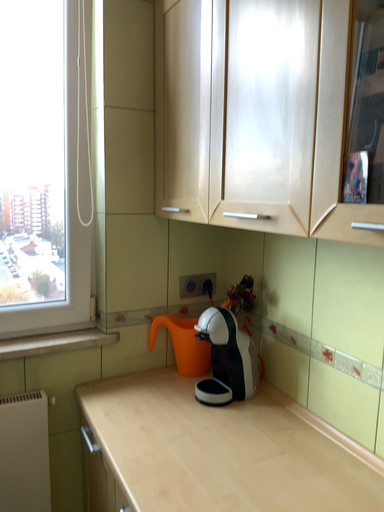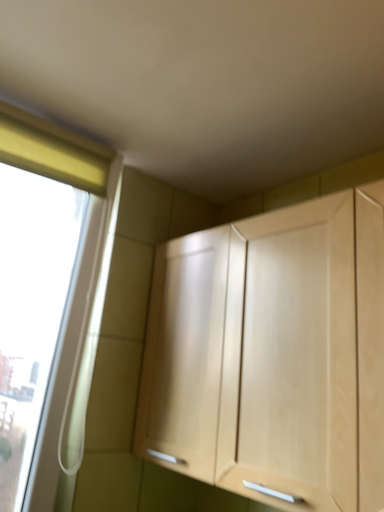
Question: How did the camera likely rotate when shooting the video?

Choices:
 (A) rotated left
 (B) rotated right

Answer: (B)